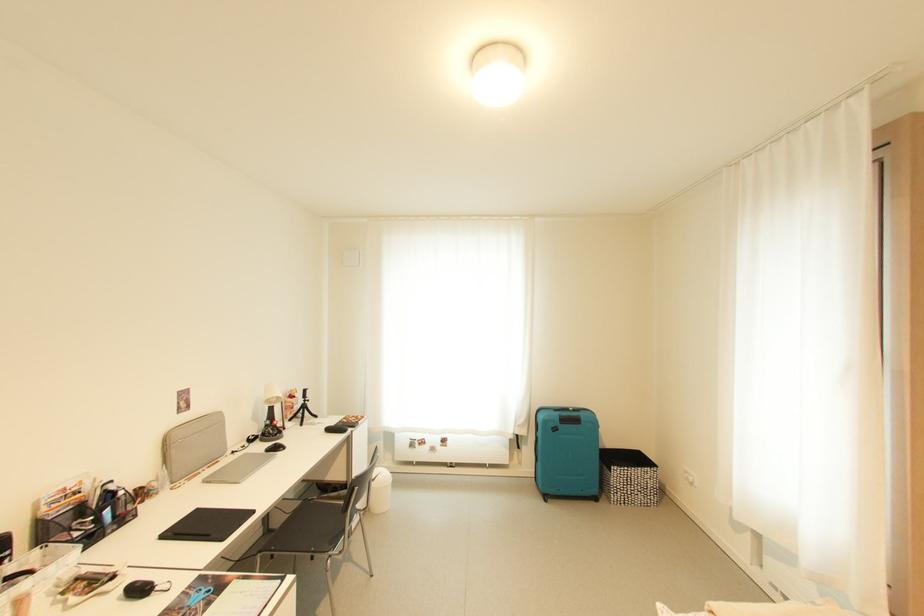
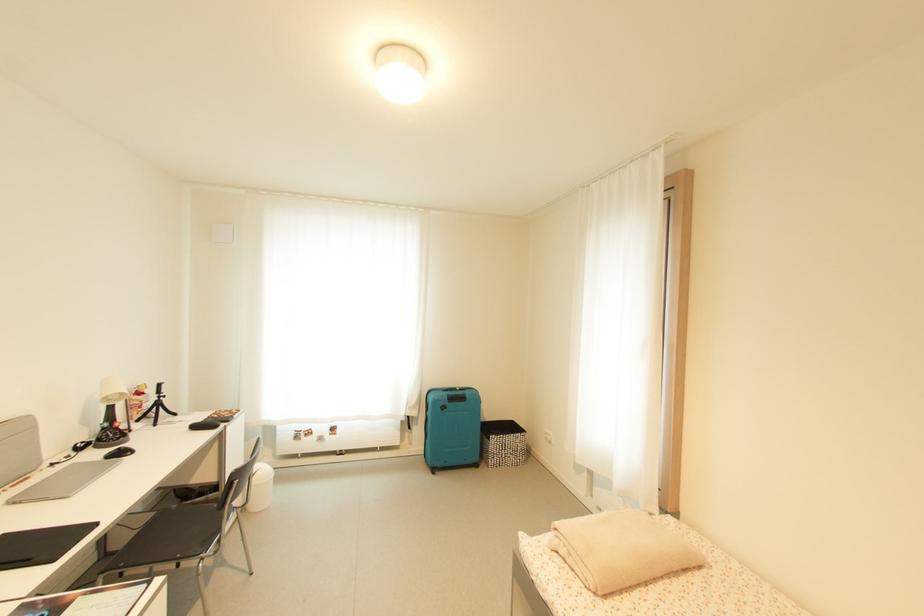
Question: Which direction would the cameraman need to move to produce the second image? Reply with the corresponding letter.

Choices:
 (A) Left
 (B) Right
 (C) Forward
 (D) Backward

Answer: (D)